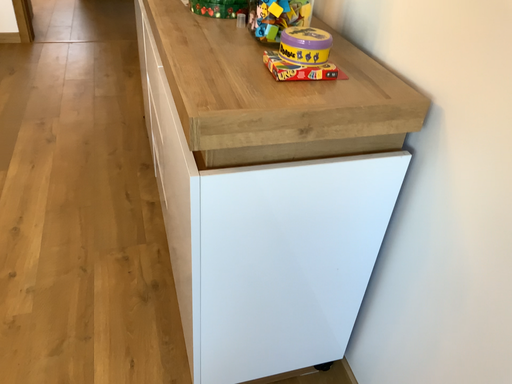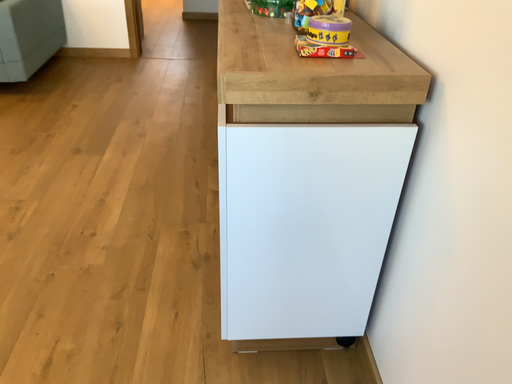
Question: How did the camera likely rotate when shooting the video?

Choices:
 (A) rotated right
 (B) rotated left

Answer: (B)